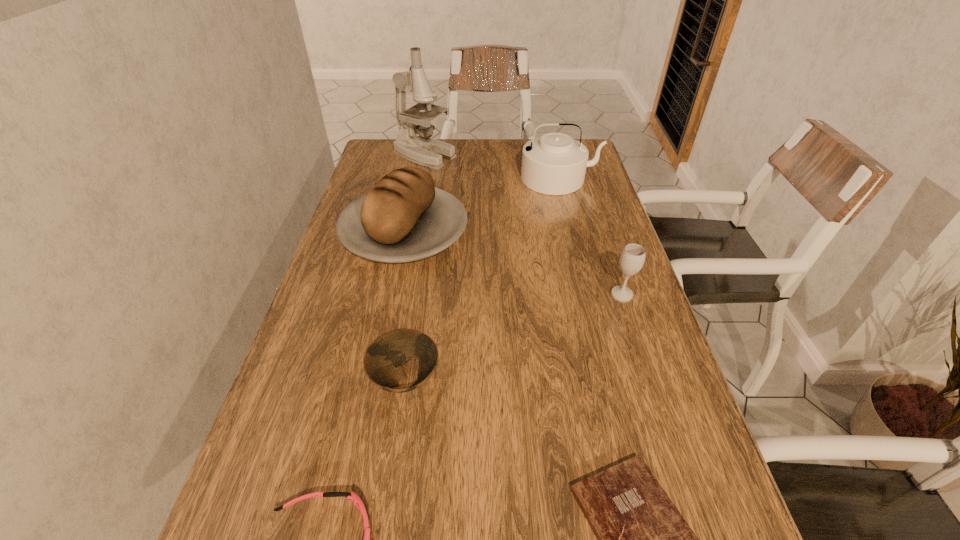
At what (x,y) coordinates should I click in order to perform the action: click on vacant region located on the back of the fourth shortest object. Please return your answer as a coordinate pair (x, y). The height and width of the screenshot is (540, 960). Looking at the image, I should click on (596, 217).

The image size is (960, 540). In order to click on vacant space located 0.140m on the front of the third nearest object in this screenshot , I will do `click(390, 488)`.

Where is `microscope that is at the far edge`? This screenshot has height=540, width=960. microscope that is at the far edge is located at coordinates (423, 150).

Identify the location of kettle located at the far edge. The image size is (960, 540). (554, 164).

The image size is (960, 540). I want to click on microscope that is at the left edge, so click(x=423, y=150).

Where is `bread located in the left edge section of the desktop`? The width and height of the screenshot is (960, 540). bread located in the left edge section of the desktop is located at coordinates (403, 217).

You are a GUI agent. You are given a task and a screenshot of the screen. Output one action in this format:
    pyautogui.click(x=<x>, y=<y>)
    Task: Click on the kettle present at the right edge
    The width and height of the screenshot is (960, 540).
    Given the screenshot: What is the action you would take?
    pyautogui.click(x=554, y=164)

Find the location of a particular element. wineglass at the right edge is located at coordinates (632, 258).

Where is `object at the far left corner`? The width and height of the screenshot is (960, 540). object at the far left corner is located at coordinates (423, 150).

The width and height of the screenshot is (960, 540). What are the coordinates of `object located at the far right corner` in the screenshot? It's located at (554, 164).